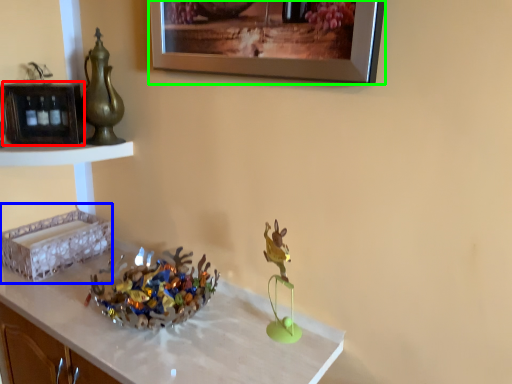
Question: Based on their relative distances, which object is nearer to shelf (highlighted by a red box)? Choose from shelf (highlighted by a blue box) and picture frame (highlighted by a green box).

Choices:
 (A) shelf
 (B) picture frame

Answer: (A)